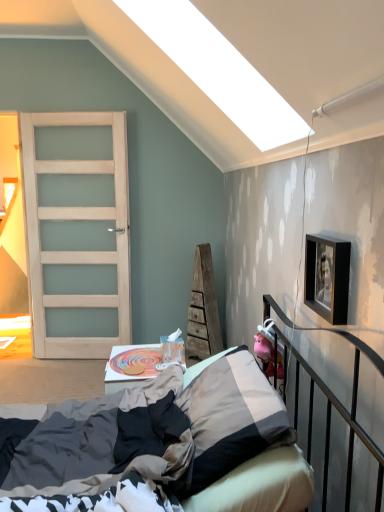
Question: Is point (127, 295) closer or farther from the camera than point (261, 350)?

Choices:
 (A) closer
 (B) farther

Answer: (B)

Question: Is satin wood door at left bigger or smaller than pink rubber piggy bank at right?

Choices:
 (A) small
 (B) big

Answer: (B)

Question: Which object is the farthest from the textured beige bed at center?

Choices:
 (A) pink rubber piggy bank at right
 (B) satin wood door at left
 (C) wooden toy at center
 (D) black matte picture frame at upper right
 (E) textured gray pillow at center

Answer: (B)

Question: Considering the real-world distances, which object is closest to the pink rubber piggy bank at right?

Choices:
 (A) black matte picture frame at upper right
 (B) satin wood door at left
 (C) textured gray pillow at center
 (D) wooden toy at center
 (E) textured beige bed at center

Answer: (E)